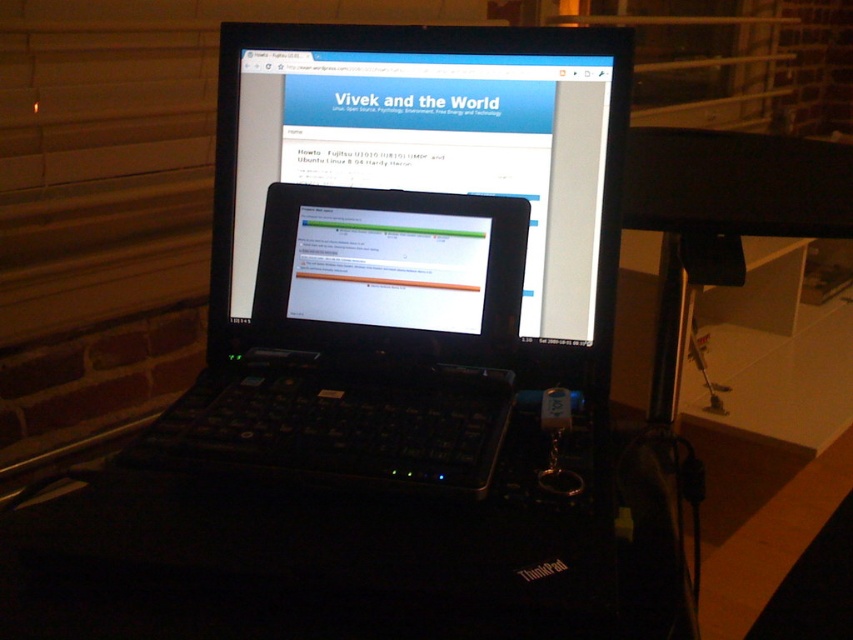
Which of these two, black plastic laptop at center or matte black laptop at center, stands taller?

black plastic laptop at center

Can you confirm if black plastic laptop at center is smaller than matte black laptop at center?

Incorrect, black plastic laptop at center is not smaller in size than matte black laptop at center.

Is point (300, 76) positioned behind point (494, 99)?

Yes.

In order to click on black plastic laptop at center in this screenshot , I will do `click(433, 150)`.